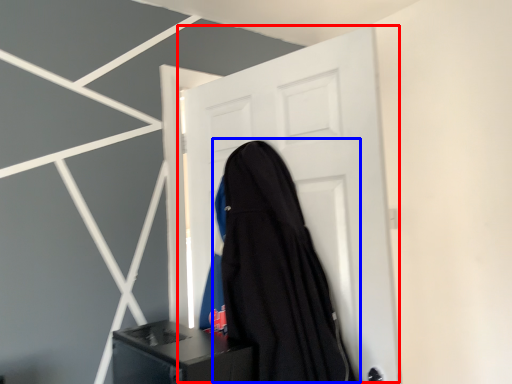
Question: Among these objects, which one is nearest to the camera, door (highlighted by a red box) or garment (highlighted by a blue box)?

Choices:
 (A) door
 (B) garment

Answer: (B)